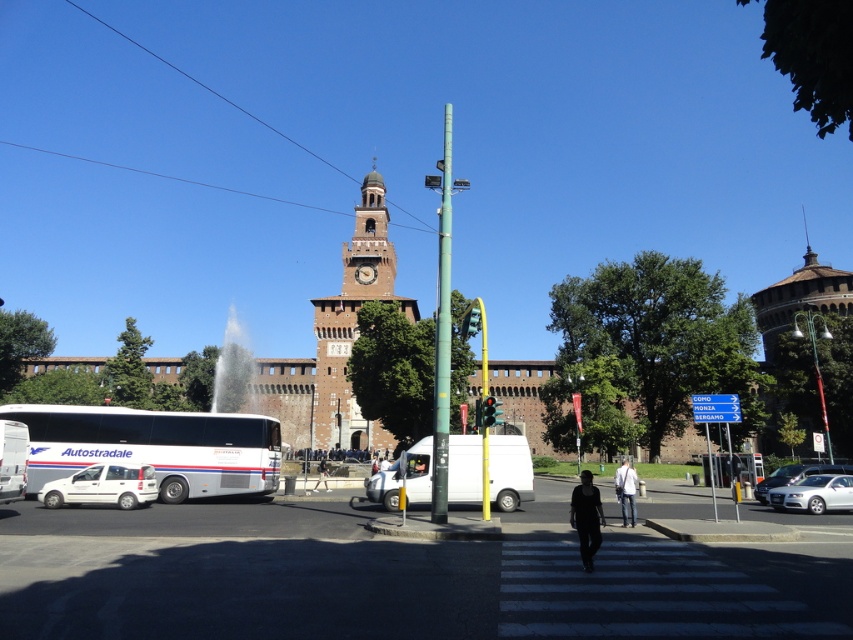
You are a pedestrian standing at the crosswalk in the image. You see two white matte vans. Which one is closer to you, the white matte van at center or the white matte van at lower left?

The white matte van at center is closer to the viewer than the white matte van at lower left.

You are a delivery driver trying to navigate through the busy street in the image. You see a white matte van at center and a white matte van at lower left. Which van should you avoid to prevent blocking the crosswalk?

The white matte van at center has a larger size compared to the white matte van at lower left. Therefore, you should avoid the white matte van at center to prevent blocking the crosswalk since it occupies more space.